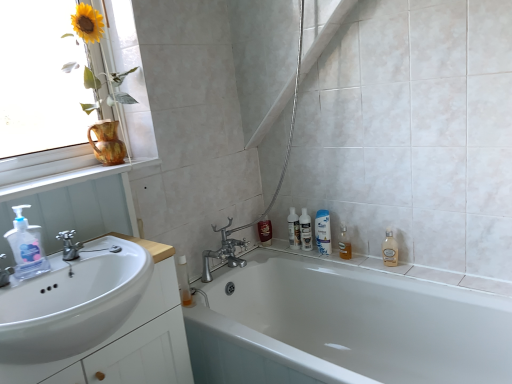
Measure the distance between white glossy mouthwash at upper right, the first mouthwash when ordered from left to right, and camera.

white glossy mouthwash at upper right, the first mouthwash when ordered from left to right, is 1.98 meters from camera.

Describe the element at coordinates (323, 232) in the screenshot. This screenshot has height=384, width=512. I see `white glossy mouthwash at upper right, the first mouthwash when ordered from left to right` at that location.

You are a GUI agent. You are given a task and a screenshot of the screen. Output one action in this format:
    pyautogui.click(x=<x>, y=<y>)
    Task: Click on the chrome metallic faucet at sink left
    The image size is (512, 384).
    Given the screenshot: What is the action you would take?
    pyautogui.click(x=69, y=245)

This screenshot has height=384, width=512. What do you see at coordinates (69, 245) in the screenshot?
I see `chrome metallic faucet at sink left` at bounding box center [69, 245].

Identify the location of translucent plastic mouthwash at right, which is the first mouthwash in right-to-left order. This screenshot has height=384, width=512. (x=344, y=243).

The height and width of the screenshot is (384, 512). What do you see at coordinates (390, 249) in the screenshot? I see `clear glass bottle at right, the first cleaning product when ordered from right to left` at bounding box center [390, 249].

The image size is (512, 384). Identify the location of shiny brown bottle at center, which is counted as the 3th toiletry, starting from the right. [x=265, y=231].

Is white glossy bottles at center, acting as the 2th toiletry starting from the right, inside or outside of translucent plastic bottles at center, which appears as the first toiletry when viewed from the right?

white glossy bottles at center, acting as the 2th toiletry starting from the right, is located beyond the bounds of translucent plastic bottles at center, which appears as the first toiletry when viewed from the right.

Which object is thinner, white glossy bottles at center, acting as the 2th toiletry starting from the right, or translucent plastic bottles at center, which appears as the first toiletry when viewed from the right?

With smaller width is translucent plastic bottles at center, which appears as the first toiletry when viewed from the right.

Which of these two, white glossy bottles at center, acting as the 2th toiletry starting from the right, or translucent plastic bottles at center, which appears as the first toiletry when viewed from the right, stands shorter?

white glossy bottles at center, acting as the 2th toiletry starting from the right.

What's the angular difference between white glossy bottles at center, acting as the 2th toiletry starting from the right, and translucent plastic bottles at center, which appears as the first toiletry when viewed from the right,'s facing directions?

There is a 0.00609-degree angle between the facing directions of white glossy bottles at center, acting as the 2th toiletry starting from the right, and translucent plastic bottles at center, which appears as the first toiletry when viewed from the right.

Between translucent plastic bottle at lower left and white glossy bottles at center, the 2th toiletry viewed from the left, which one has smaller width?

Thinner between the two is translucent plastic bottle at lower left.

Does translucent plastic bottle at lower left touch white glossy bottles at center, the 2th toiletry viewed from the left?

No, translucent plastic bottle at lower left is not making contact with white glossy bottles at center, the 2th toiletry viewed from the left.

Does translucent plastic bottle at lower left appear on the right side of white glossy bottles at center, the 2th toiletry viewed from the left?

No, translucent plastic bottle at lower left is not to the right of white glossy bottles at center, the 2th toiletry viewed from the left.

Visually, is chrome metallic faucet at sink left positioned to the left or to the right of white wood window sill at upper left?

chrome metallic faucet at sink left is to the right of white wood window sill at upper left.

Who is smaller, chrome metallic faucet at sink left or white wood window sill at upper left?

chrome metallic faucet at sink left is smaller.

Based on the photo, is chrome metallic faucet at sink left touching white wood window sill at upper left?

No, chrome metallic faucet at sink left is not with white wood window sill at upper left.

Is chrome metallic faucet at sink left surrounding white wood window sill at upper left?

No, white wood window sill at upper left is not a part of chrome metallic faucet at sink left.

From the image's perspective, is chrome metallic faucet at sink left below shiny brown bottle at center, the first toiletry when ordered from left to right?

No, from the image's perspective, chrome metallic faucet at sink left is not below shiny brown bottle at center, the first toiletry when ordered from left to right.

How far apart are chrome metallic faucet at sink left and shiny brown bottle at center, the first toiletry when ordered from left to right?

chrome metallic faucet at sink left is 3.53 feet away from shiny brown bottle at center, the first toiletry when ordered from left to right.

Would you say chrome metallic faucet at sink left is a long distance from shiny brown bottle at center, the first toiletry when ordered from left to right?

Yes, chrome metallic faucet at sink left and shiny brown bottle at center, the first toiletry when ordered from left to right, are quite far apart.

In the image, is chrome metallic faucet at sink left on the left side or the right side of shiny brown bottle at center, the first toiletry when ordered from left to right?

From the image, it's evident that chrome metallic faucet at sink left is to the left of shiny brown bottle at center, the first toiletry when ordered from left to right.

Would you say white wood window sill at upper left is part of white glossy sink at lower left's contents?

No, white wood window sill at upper left is not inside white glossy sink at lower left.

Find the location of a particular element. This screenshot has height=384, width=512. window sill positioned vertically above the white glossy sink at lower left (from a real-world perspective) is located at coordinates (70, 178).

Considering the positions of objects chrome metallic faucet at sink left and matte ceramic vase at upper left in the image provided, who is in front, chrome metallic faucet at sink left or matte ceramic vase at upper left?

chrome metallic faucet at sink left is more forward.

Can you confirm if chrome metallic faucet at sink left is taller than matte ceramic vase at upper left?

Incorrect, the height of chrome metallic faucet at sink left is not larger of that of matte ceramic vase at upper left.

How many degrees apart are the facing directions of chrome metallic faucet at sink left and matte ceramic vase at upper left?

0.439 degrees separate the facing orientations of chrome metallic faucet at sink left and matte ceramic vase at upper left.

Which object is positioned more to the left, chrome metallic faucet at sink left or matte ceramic vase at upper left?

Positioned to the left is matte ceramic vase at upper left.

From a real-world perspective, who is located higher, translucent plastic mouthwash at right, which is the first mouthwash in right-to-left order, or white glossy bottles at center, acting as the 2th toiletry starting from the right?

white glossy bottles at center, acting as the 2th toiletry starting from the right.

Locate an element on the screen. The height and width of the screenshot is (384, 512). mouthwash that is the 2nd object located below the white glossy bottles at center, acting as the 2th toiletry starting from the right (from the image's perspective) is located at coordinates (344, 243).

Which of these two, translucent plastic mouthwash at right, the second mouthwash in the left-to-right sequence, or white glossy bottles at center, the 2th toiletry viewed from the left, stands shorter?

Standing shorter between the two is translucent plastic mouthwash at right, the second mouthwash in the left-to-right sequence.

Is translucent plastic mouthwash at right, which is the first mouthwash in right-to-left order, positioned before white glossy bottles at center, the 2th toiletry viewed from the left?

Yes, it is in front of white glossy bottles at center, the 2th toiletry viewed from the left.

At what (x,y) coordinates should I click in order to perform the action: click on toiletry lying on the right of white glossy bottles at center, acting as the 2th toiletry starting from the right. Please return your answer as a coordinate pair (x, y). Looking at the image, I should click on (305, 231).

Find the location of a particular element. The height and width of the screenshot is (384, 512). bottle lying below the white glossy bottles at center, the 2th toiletry viewed from the left (from the image's perspective) is located at coordinates (184, 282).

From the image, which object appears to be nearer to shiny brown bottle at center, which is counted as the 3th toiletry, starting from the right, white wood window sill at upper left or clear plastic pump bottle at left, marked as the 2th cleaning product in a right-to-left arrangement?

white wood window sill at upper left lies closer to shiny brown bottle at center, which is counted as the 3th toiletry, starting from the right, than the other object.

Estimate the real-world distances between objects in this image. Which object is further from white glossy sink at lower left, clear plastic pump bottle at left, the 1th cleaning product when ordered from left to right, or white glossy bathtub at center?

The object further to white glossy sink at lower left is white glossy bathtub at center.

Estimate the real-world distances between objects in this image. Which object is further from translucent plastic mouthwash at right, which is the first mouthwash in right-to-left order, white glossy bathtub at center or matte ceramic vase at upper left?

matte ceramic vase at upper left is positioned further to the anchor translucent plastic mouthwash at right, which is the first mouthwash in right-to-left order.

From the image, which object appears to be nearer to white glossy sink at lower left, clear glass bottle at right, the first cleaning product when ordered from right to left, or translucent plastic bottle at lower left?

translucent plastic bottle at lower left.

Considering their positions, is matte ceramic vase at upper left positioned further to chrome metallic faucet at sink left than clear glass bottle at right, the 2th cleaning product in the front-to-back sequence?

clear glass bottle at right, the 2th cleaning product in the front-to-back sequence.

Estimate the real-world distances between objects in this image. Which object is further from clear plastic pump bottle at left, the first cleaning product positioned from the front, translucent plastic mouthwash at right, which is the first mouthwash in right-to-left order, or shiny brown bottle at center, which is counted as the 3th toiletry, starting from the right?

translucent plastic mouthwash at right, which is the first mouthwash in right-to-left order, is positioned further to the anchor clear plastic pump bottle at left, the first cleaning product positioned from the front.

Considering their positions, is translucent plastic bottles at center, the third toiletry viewed from the left, positioned closer to clear glass bottle at right, the first cleaning product when ordered from right to left, than white glossy sink at lower left?

translucent plastic bottles at center, the third toiletry viewed from the left, lies closer to clear glass bottle at right, the first cleaning product when ordered from right to left, than the other object.

Considering their positions, is translucent plastic mouthwash at right, the second mouthwash in the left-to-right sequence, positioned further to white glossy bottles at center, the 2th toiletry viewed from the left, than clear glass bottle at right, the 1th cleaning product viewed from the back?

Among the two, clear glass bottle at right, the 1th cleaning product viewed from the back, is located further to white glossy bottles at center, the 2th toiletry viewed from the left.

Locate an element on the screen. This screenshot has width=512, height=384. toiletry situated between white glossy bottles at center, acting as the 2th toiletry starting from the right, and white glossy mouthwash at upper right, the first mouthwash when ordered from left to right, from left to right is located at coordinates (305, 231).

Locate an element on the screen. This screenshot has height=384, width=512. bathtub located between clear plastic pump bottle at left, marked as the 2th cleaning product in a right-to-left arrangement, and white glossy mouthwash at upper right, the first mouthwash when ordered from left to right, in the left-right direction is located at coordinates (343, 327).

You are a GUI agent. You are given a task and a screenshot of the screen. Output one action in this format:
    pyautogui.click(x=<x>, y=<y>)
    Task: Click on the bottle between matte ceramic vase at upper left and translucent plastic bottles at center, the third toiletry viewed from the left, from left to right
    
    Given the screenshot: What is the action you would take?
    pyautogui.click(x=184, y=282)

Where is `toiletry between chrome metallic faucet at sink left and white glossy bottles at center, acting as the 2th toiletry starting from the right, from front to back`? Image resolution: width=512 pixels, height=384 pixels. toiletry between chrome metallic faucet at sink left and white glossy bottles at center, acting as the 2th toiletry starting from the right, from front to back is located at coordinates (305, 231).